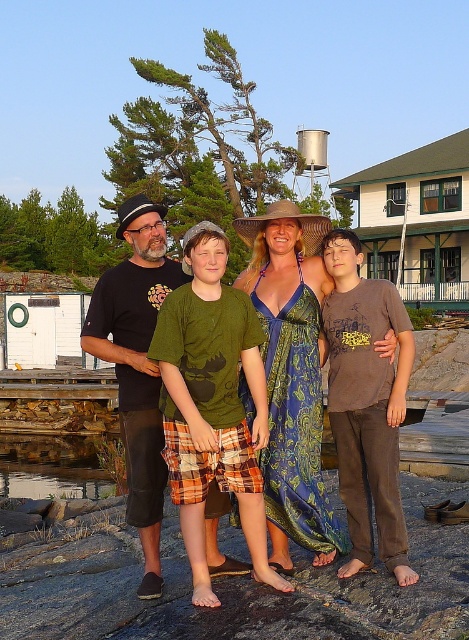
You are a tailor who needs to determine which shirt requires more fabric between the green cotton shirt at center and the brown cotton shirt at right. Which one would need more fabric?

The green cotton shirt at center requires more fabric since it is larger in size than the brown cotton shirt at right.